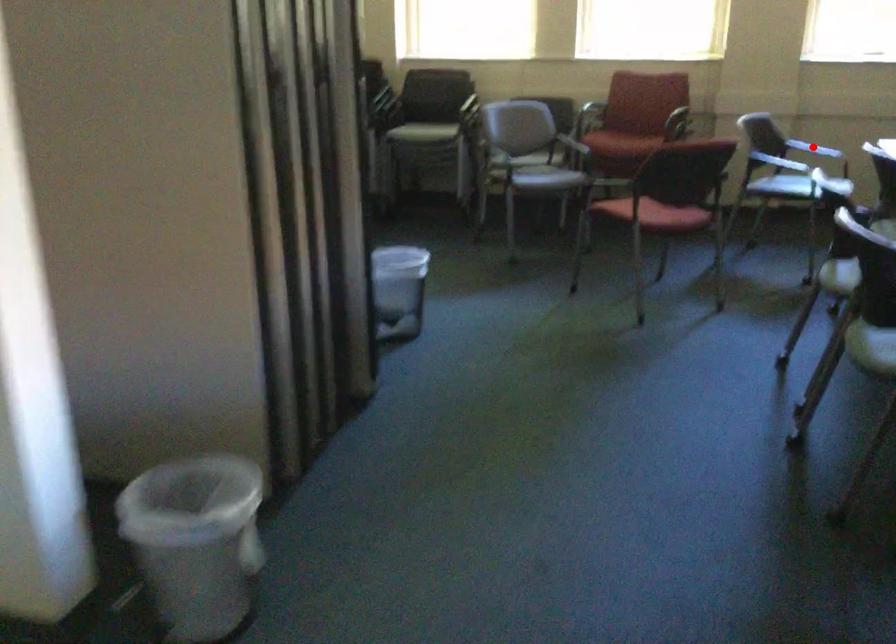
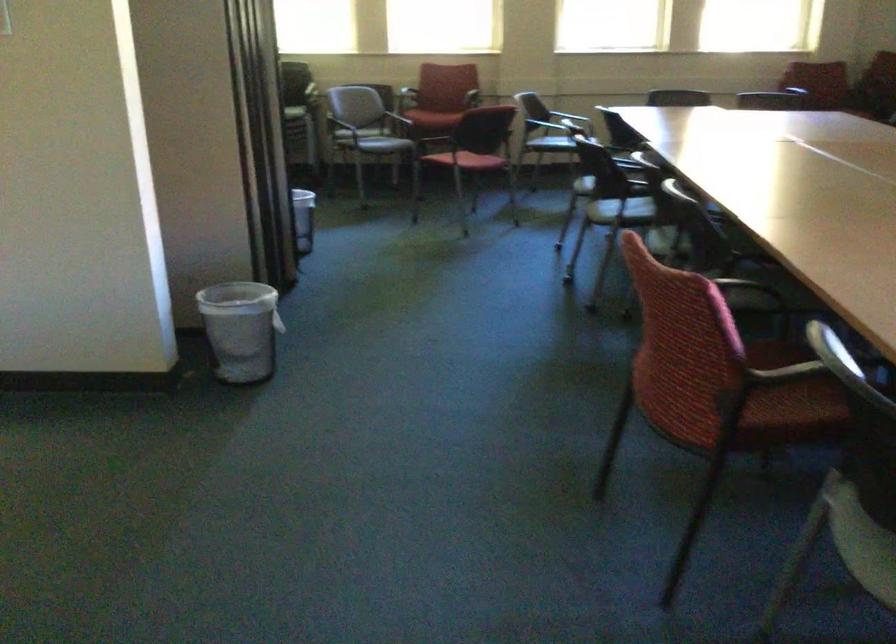
Question: I am providing you with two images of the same scene from different viewpoints. A red point is marked on the first image. At the location where the point appears in image 1, is it still visible in image 2?

Choices:
 (A) Yes
 (B) No

Answer: (B)